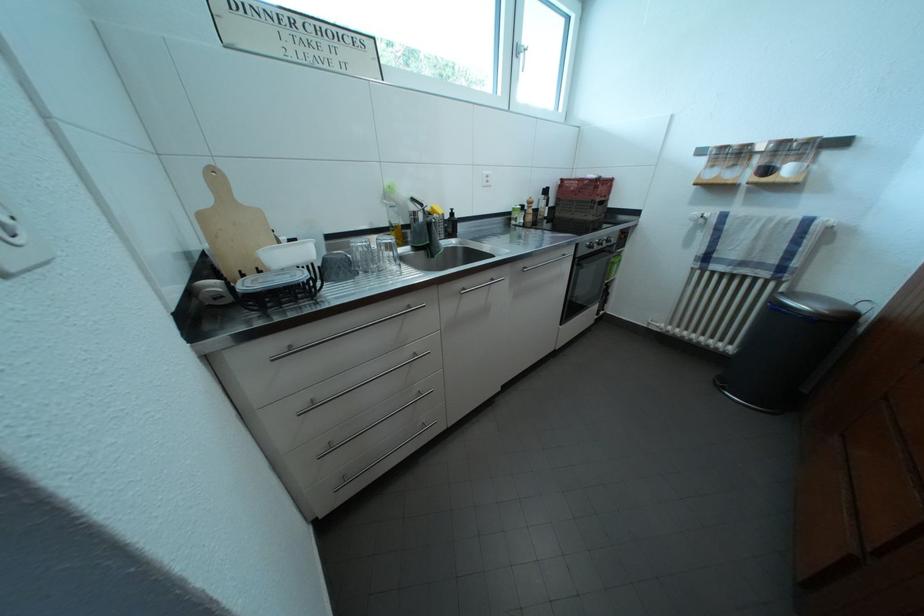
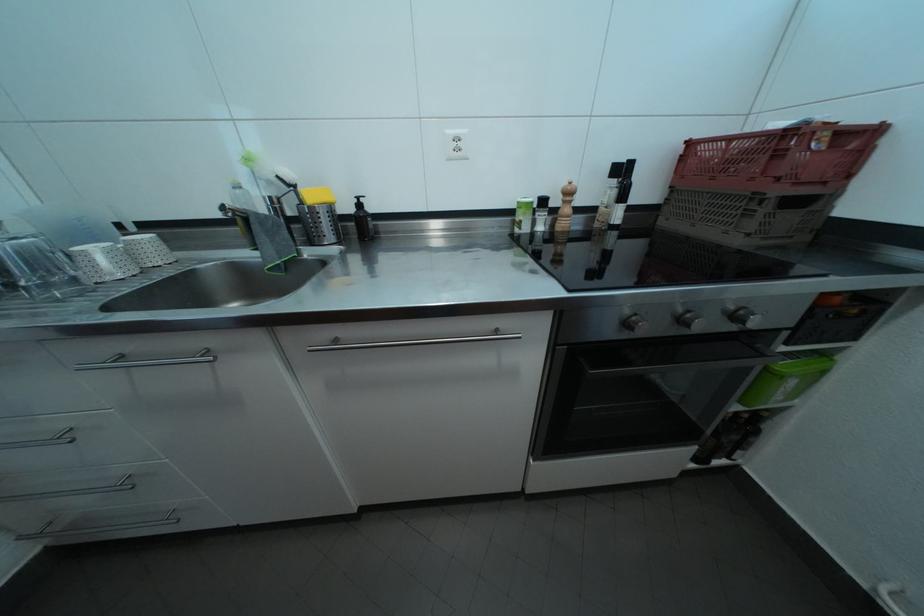
Find the pixel in the second image that matches point 431,209 in the first image.

(304, 192)